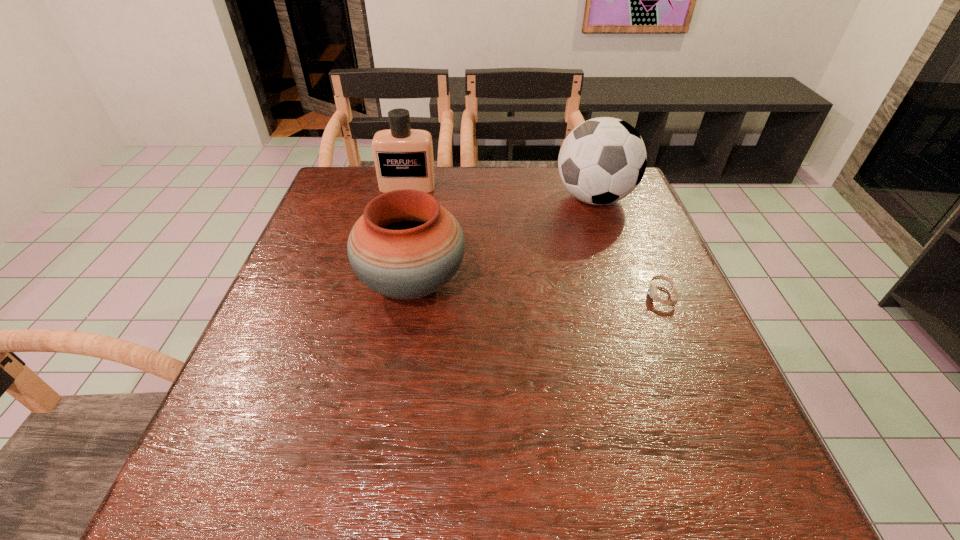
Find the location of `unoccupied position between the watch and the pottery`. unoccupied position between the watch and the pottery is located at coordinates (537, 289).

In order to click on free space between the pottery and the watch in this screenshot , I will do `click(537, 289)`.

Locate an element on the screen. The width and height of the screenshot is (960, 540). unoccupied position between the soccer ball and the perfume is located at coordinates (501, 192).

Find the location of a particular element. free spot between the soccer ball and the pottery is located at coordinates (503, 241).

Select which object appears as the closest to the pottery. Please provide its 2D coordinates. Your answer should be formatted as a tuple, i.e. [(x, y)], where the tuple contains the x and y coordinates of a point satisfying the conditions above.

[(403, 157)]

In order to click on object that ranks as the second closest to the pottery in this screenshot , I will do `click(602, 160)`.

Where is `vacant area that satisfies the following two spatial constraints: 1. on the front label of the perfume; 2. on the left side of the pottery`? This screenshot has width=960, height=540. vacant area that satisfies the following two spatial constraints: 1. on the front label of the perfume; 2. on the left side of the pottery is located at coordinates tap(386, 284).

You are a GUI agent. You are given a task and a screenshot of the screen. Output one action in this format:
    pyautogui.click(x=<x>, y=<y>)
    Task: Click on the free point that satisfies the following two spatial constraints: 1. on the front label of the perfume; 2. on the left side of the pottery
    The image size is (960, 540).
    Given the screenshot: What is the action you would take?
    pyautogui.click(x=386, y=284)